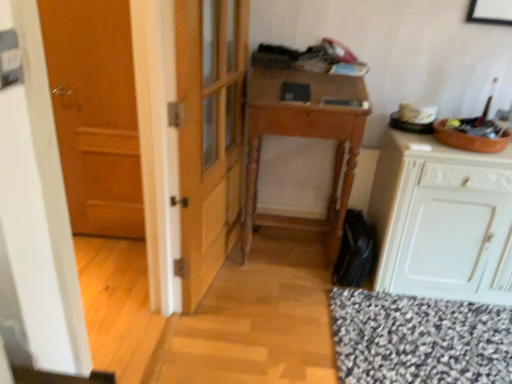
Where is `free space in front of white painted wood cabinet at right`? This screenshot has width=512, height=384. free space in front of white painted wood cabinet at right is located at coordinates (443, 341).